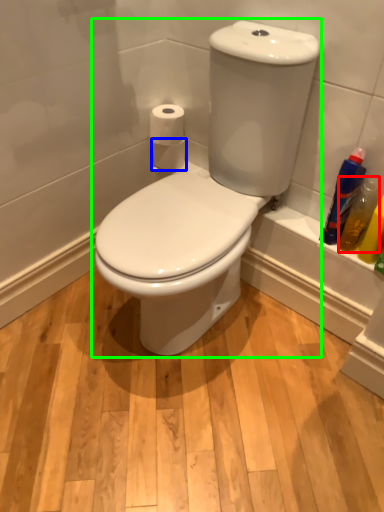
Question: Which object is the farthest from cleaning product (highlighted by a red box)? Choose among these: toilet paper (highlighted by a blue box) or toilet (highlighted by a green box).

Choices:
 (A) toilet paper
 (B) toilet

Answer: (A)